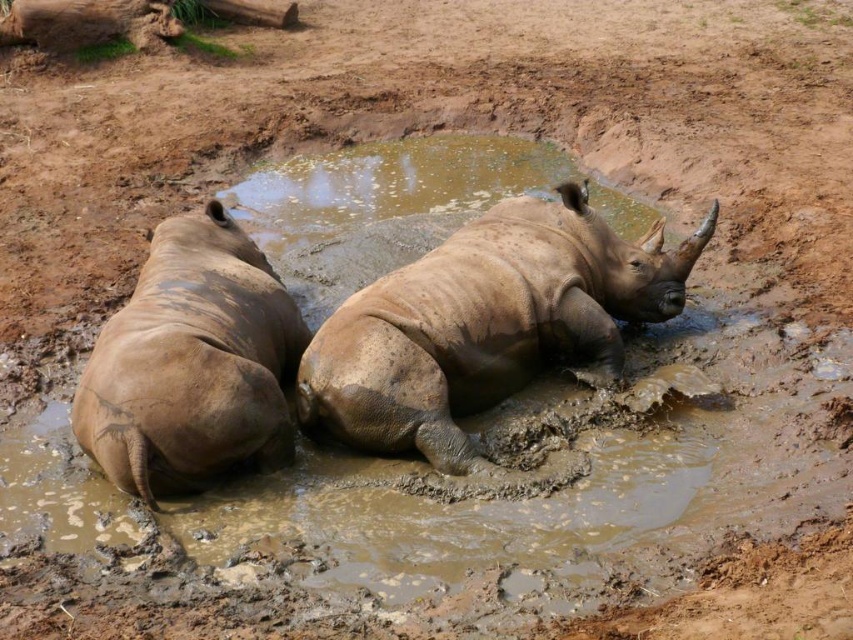
You are a wildlife photographer aiming to capture a closeup shot of the muddy skin rhino at center. Your camera has a minimum focusing distance of 5 meters. Can you take the photo without moving closer than 5 meters?

The muddy skin rhino at center is 4.74 meters from the camera, which is closer than the minimum focusing distance of 5 meters. Therefore, you cannot take the photo without moving further back to at least 5 meters.

You are a wildlife photographer aiming to capture a closeup shot of the muddy skin rhino at center. Your camera is currently focused on the point at coordinates point [486,324]. Is this point the correct location to focus on to get the best closeup of the muddy skin rhino at center?

Yes, the point [486,324] represents the muddy skin rhino at center, so focusing on this point will capture the best closeup of the muddy skin rhino at center.

You are standing at a point where you can see the entire scene. A safety guideline states that you must stay at least 5 meters away from any wild animal. Is the point at coordinate point (544, 340) safe to stand at?

The distance of point (544, 340) from camera is 5.39 meters, so standing at point (544, 340) is safe as it exceeds the 5 meter requirement.